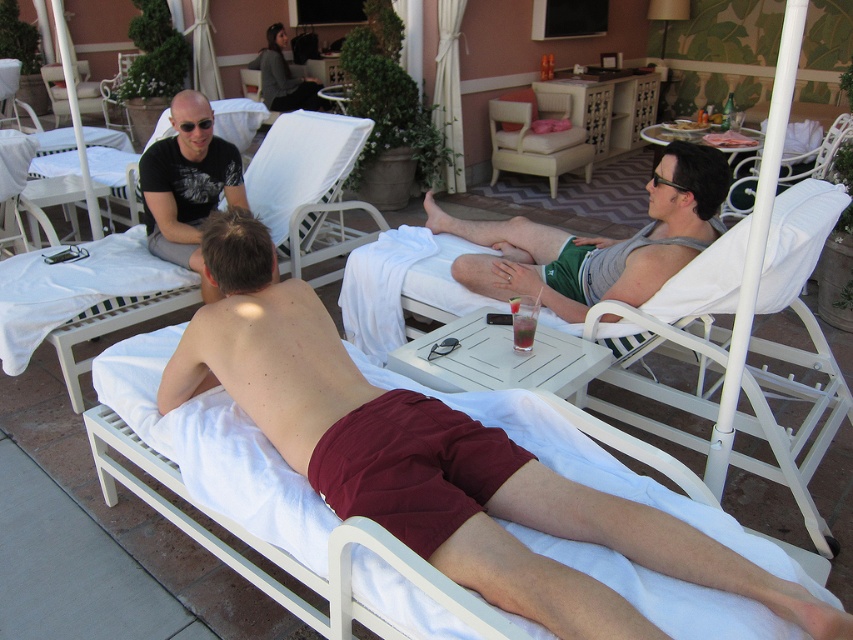
Which of these two, white plastic beach chair at upper left or translucent plastic cup at center, stands taller?

With more height is white plastic beach chair at upper left.

Does point (53, 106) come in front of point (514, 324)?

No.

Is point (97, 83) positioned behind point (519, 336)?

Yes, point (97, 83) is behind point (519, 336).

Find the location of a particular element. white plastic beach chair at upper left is located at coordinates (86, 90).

Does point (312, 252) come closer to viewer compared to point (518, 136)?

Yes, it is in front of point (518, 136).

Who is positioned more to the right, maroon fabric beach chair at center or light beige fabric armchair at center?

Positioned to the right is light beige fabric armchair at center.

Where is `maroon fabric beach chair at center`? This screenshot has width=853, height=640. maroon fabric beach chair at center is located at coordinates (83, 300).

Can you confirm if green cotton shorts at center is taller than matte black t-shirt at upper left?

No, green cotton shorts at center is not taller than matte black t-shirt at upper left.

The width and height of the screenshot is (853, 640). Describe the element at coordinates (596, 241) in the screenshot. I see `green cotton shorts at center` at that location.

Locate an element on the screen. green cotton shorts at center is located at coordinates (596, 241).